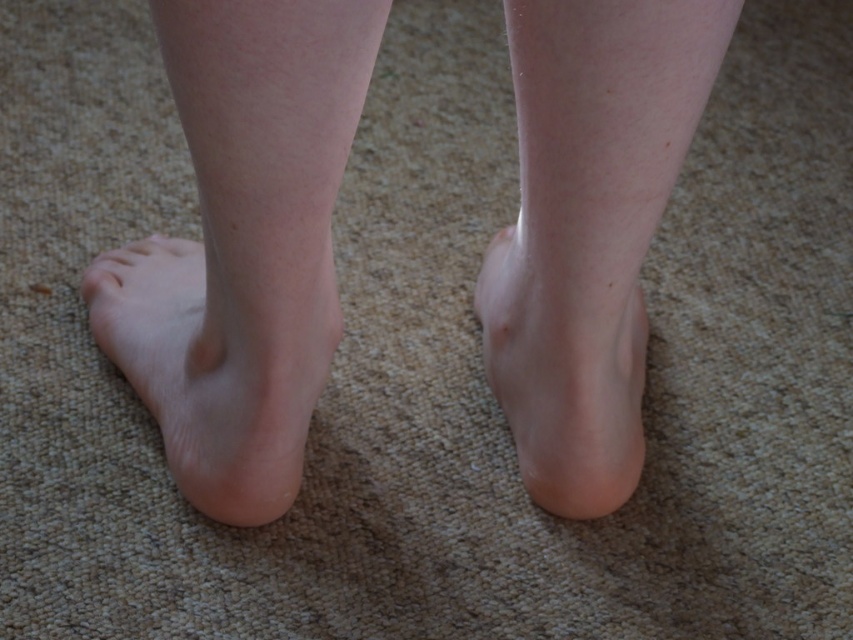
Does skin smooth feet at center appear over pale skin at center?

No, skin smooth feet at center is not above pale skin at center.

Locate an element on the screen. The width and height of the screenshot is (853, 640). skin smooth feet at center is located at coordinates (242, 244).

Is smooth skin leg at left bigger than pale skin at center?

Yes.

Between point (300, 320) and point (666, 60), which one is positioned in front?

Point (666, 60) is more forward.

Is point (363, 97) positioned in front of point (576, 484)?

That is True.

Locate an element on the screen. smooth skin leg at left is located at coordinates tap(242, 244).

Is point (631, 397) farther from viewer compared to point (267, 364)?

Yes, point (631, 397) is behind point (267, 364).

Who is positioned more to the right, pale skin at center or smooth skin foot at lower left?

From the viewer's perspective, pale skin at center appears more on the right side.

Is point (552, 212) positioned behind point (323, 234)?

Yes, it is.

Locate an element on the screen. This screenshot has width=853, height=640. pale skin at center is located at coordinates coord(589,228).